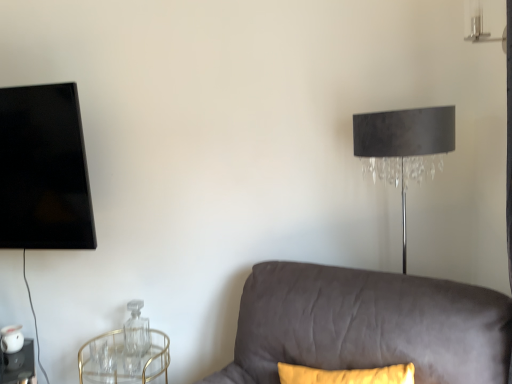
Question: Is transparent glass bottle at lower left to the left or to the right of clear glass table at lower left in the image?

Choices:
 (A) right
 (B) left

Answer: (A)

Question: From the image's perspective, is transparent glass bottle at lower left above or below clear glass table at lower left?

Choices:
 (A) below
 (B) above

Answer: (B)

Question: Based on their relative distances, which object is farther from the transparent glass bottle at lower left?

Choices:
 (A) gold metallic round table at lower left
 (B) clear glass table at lower left
 (C) suede gray couch at lower right
 (D) matte black lampshade at upper right

Answer: (D)

Question: Which object is positioned farthest from the gold metallic round table at lower left?

Choices:
 (A) transparent glass bottle at lower left
 (B) matte black lampshade at upper right
 (C) suede gray couch at lower right
 (D) clear glass table at lower left

Answer: (B)